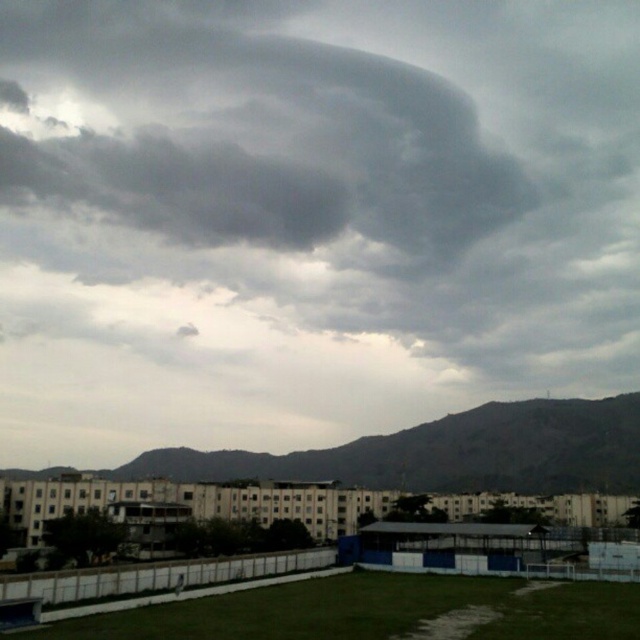
You are a pilot flying a small plane and want to navigate between the dark gray cloud at upper center and the gray rocky mountain at lower center. Which direction should you turn to avoid both obstacles?

The dark gray cloud at upper center is positioned on the left side of the gray rocky mountain at lower center. To avoid both obstacles, you should turn to the right, moving away from the dark gray cloud at upper center and the gray rocky mountain at lower center.

What is located at the coordinates point [244,134] in the image?

At point [244,134] lies dark gray cloud at upper center.